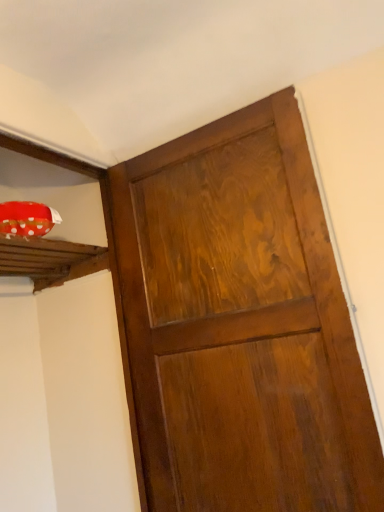
Locate an element on the screen. This screenshot has width=384, height=512. wooden plank at upper left is located at coordinates (43, 257).

This screenshot has height=512, width=384. Describe the element at coordinates (43, 257) in the screenshot. I see `wooden plank at upper left` at that location.

Measure the distance between wooden plank at upper left and camera.

The depth of wooden plank at upper left is 1.25 meters.

At what (x,y) coordinates should I click in order to perform the action: click on glossy wood door at center. Please return your answer as a coordinate pair (x, y). Looking at the image, I should click on (241, 324).

This screenshot has width=384, height=512. Describe the element at coordinates (241, 324) in the screenshot. I see `glossy wood door at center` at that location.

At what (x,y) coordinates should I click in order to perform the action: click on wooden plank at upper left. Please return your answer as a coordinate pair (x, y). This screenshot has height=512, width=384. Looking at the image, I should click on (43, 257).

Does glossy wood door at center appear on the right side of wooden plank at upper left?

Yes.

Is glossy wood door at center in front of wooden plank at upper left?

Yes, glossy wood door at center is in front of wooden plank at upper left.

Which point is more forward, (180, 211) or (16, 246)?

The point (180, 211) is closer to the camera.

From the image's perspective, between glossy wood door at center and wooden plank at upper left, who is located below?

glossy wood door at center is shown below in the image.

From a real-world perspective, relative to wooden plank at upper left, is glossy wood door at center vertically above or below?

glossy wood door at center is below wooden plank at upper left.

Considering the sizes of objects glossy wood door at center and wooden plank at upper left in the image provided, who is wider, glossy wood door at center or wooden plank at upper left?

wooden plank at upper left.

Considering the relative sizes of glossy wood door at center and wooden plank at upper left in the image provided, is glossy wood door at center taller than wooden plank at upper left?

Yes.

Considering the sizes of glossy wood door at center and wooden plank at upper left in the image, is glossy wood door at center bigger or smaller than wooden plank at upper left?

Clearly, glossy wood door at center is larger in size than wooden plank at upper left.

Is glossy wood door at center completely or partially outside of wooden plank at upper left?

Yes, glossy wood door at center is not within wooden plank at upper left.

Is the surface of glossy wood door at center in direct contact with wooden plank at upper left?

No, glossy wood door at center is not next to wooden plank at upper left.

In the scene shown: Is glossy wood door at center aimed at wooden plank at upper left?

No.

From the picture: What's the angular difference between glossy wood door at center and wooden plank at upper left's facing directions?

They differ by 90.8 degrees in their facing directions.

In the image, there is a glossy wood door at center. Where is `shelf above it (from the image's perspective)`? shelf above it (from the image's perspective) is located at coordinates (43, 257).

Based on their positions, is wooden plank at upper left located to the left or right of glossy wood door at center?

wooden plank at upper left is to the left of glossy wood door at center.

Between wooden plank at upper left and glossy wood door at center, which one is positioned in front?

Positioned in front is glossy wood door at center.

Which is nearer, [57,278] or [288,490]?

Point [57,278].

From the image's perspective, who appears lower, wooden plank at upper left or glossy wood door at center?

From the image's view, glossy wood door at center is below.

From a real-world perspective, which object stands above the other?

wooden plank at upper left is physically above.

Can you confirm if wooden plank at upper left is thinner than glossy wood door at center?

Incorrect, the width of wooden plank at upper left is not less than that of glossy wood door at center.

Between wooden plank at upper left and glossy wood door at center, which one has more height?

Standing taller between the two is glossy wood door at center.

Considering the relative sizes of wooden plank at upper left and glossy wood door at center in the image provided, is wooden plank at upper left smaller than glossy wood door at center?

Indeed, wooden plank at upper left has a smaller size compared to glossy wood door at center.

Would you say wooden plank at upper left is outside glossy wood door at center?

Yes.

Is wooden plank at upper left placed right next to glossy wood door at center?

They are not placed beside each other.

Could you tell me if wooden plank at upper left is turned towards glossy wood door at center?

No, wooden plank at upper left does not turn towards glossy wood door at center.

Can you tell me how much wooden plank at upper left and glossy wood door at center differ in facing direction?

wooden plank at upper left and glossy wood door at center are facing 90.8 degrees away from each other.

How far apart are wooden plank at upper left and glossy wood door at center?

wooden plank at upper left is 20.77 inches away from glossy wood door at center.

Find the location of a particular element. shelf above the glossy wood door at center (from the image's perspective) is located at coordinates (43, 257).

At what (x,y) coordinates should I click in order to perform the action: click on door located underneath the wooden plank at upper left (from a real-world perspective). Please return your answer as a coordinate pair (x, y). Looking at the image, I should click on (241, 324).

This screenshot has height=512, width=384. In order to click on shelf lying above the glossy wood door at center (from the image's perspective) in this screenshot , I will do `click(43, 257)`.